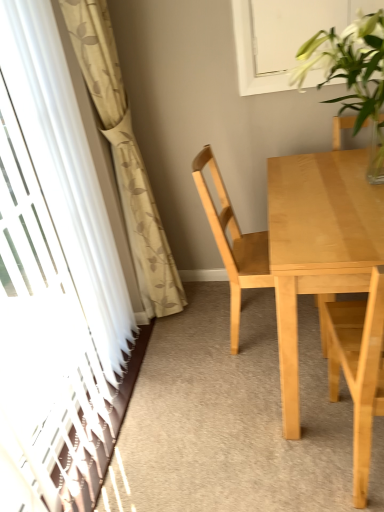
Locate an element on the screen. This screenshot has width=384, height=512. free space in front of beige floral curtain at left is located at coordinates (186, 366).